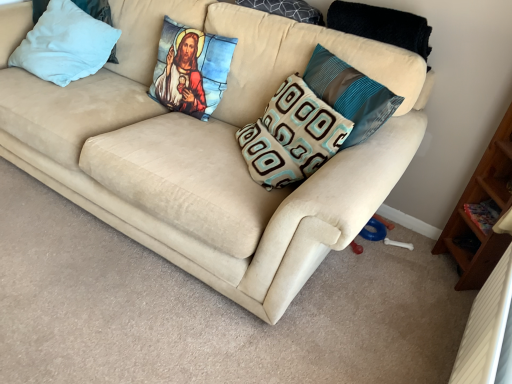
Question: Considering the positions of point (166, 79) and point (74, 16), is point (166, 79) closer or farther from the camera than point (74, 16)?

Choices:
 (A) closer
 (B) farther

Answer: (A)

Question: Considering their positions, is stained glass pillow at upper center, the second pillow viewed from the left, located in front of or behind light blue fabric pillow at upper left, the fifth pillow in the right-to-left sequence?

Choices:
 (A) front
 (B) behind

Answer: (A)

Question: Considering the real-world distances, which object is farthest from the suede beige couch at center?

Choices:
 (A) teal-patterned cushion at center-right, the fifth pillow positioned from the left
 (B) light blue fabric pillow at upper left, which is the 1th pillow in left-to-right order
 (C) stained glass pillow at upper center, the second pillow viewed from the left
 (D) brown and light blue patterned pillow at center, placed as the third pillow when sorted from left to right
 (E) dark gray textured pillow at upper center, arranged as the 2th pillow when viewed from the right

Answer: (E)

Question: Which is nearer to the brown and light blue patterned pillow at center, placed as the third pillow when sorted from left to right?

Choices:
 (A) teal-patterned cushion at center-right, the 1th pillow from the right
 (B) dark gray textured pillow at upper center, arranged as the 2th pillow when viewed from the right
 (C) stained glass pillow at upper center, marked as the fourth pillow in a right-to-left arrangement
 (D) light blue fabric pillow at upper left, the fifth pillow in the right-to-left sequence
 (E) suede beige couch at center

Answer: (A)